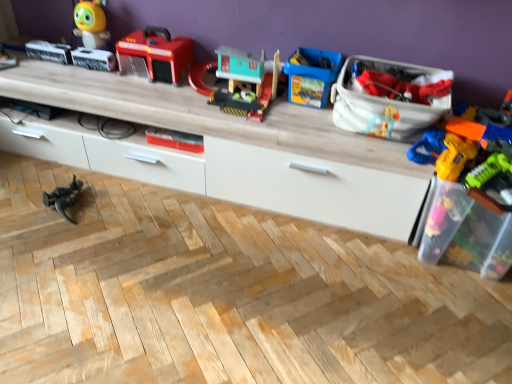
Locate an element on the screen. The image size is (512, 384). free spot to the left of matte plastic fire truck at upper center, which is the 5th toy from right to left is located at coordinates (96, 79).